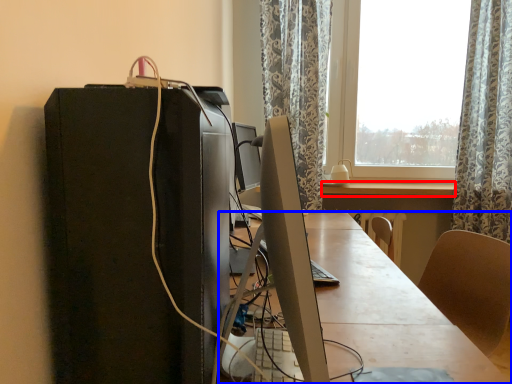
Question: Which object appears farthest to the camera in this image, table (highlighted by a red box) or desk (highlighted by a blue box)?

Choices:
 (A) table
 (B) desk

Answer: (A)